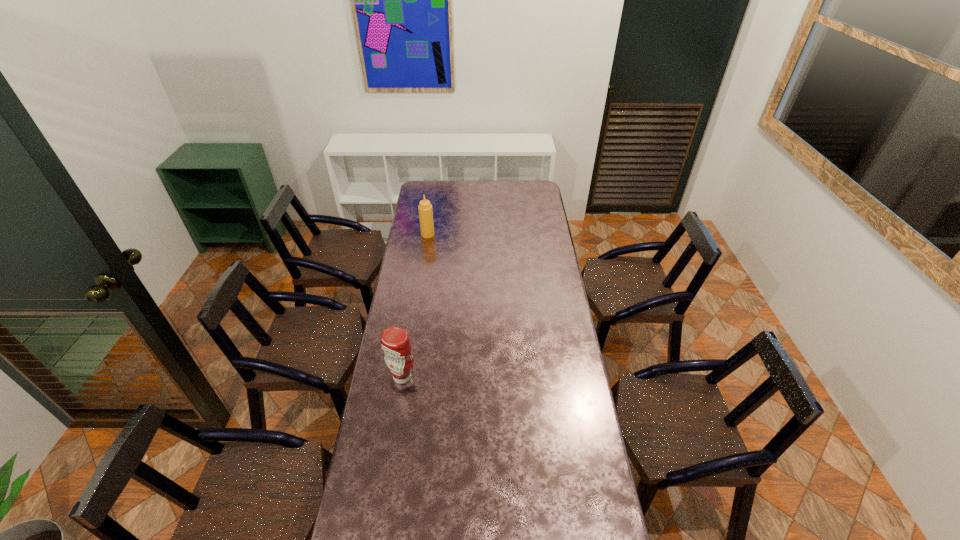
The height and width of the screenshot is (540, 960). Find the location of `the farther condiment`. the farther condiment is located at coordinates (425, 208).

In order to click on the nearer condiment in this screenshot , I will do `click(395, 341)`.

Where is `free space located 0.400m on the front of the farther object`? free space located 0.400m on the front of the farther object is located at coordinates (420, 287).

Find the location of a particular element. The width and height of the screenshot is (960, 540). free spot located 0.060m on the back of the nearer condiment is located at coordinates (406, 355).

Find the location of a particular element. vacant space at the far edge of the desktop is located at coordinates (515, 198).

You are a GUI agent. You are given a task and a screenshot of the screen. Output one action in this format:
    pyautogui.click(x=<x>, y=<y>)
    Task: Click on the vacant region at the left edge of the desktop
    This screenshot has height=540, width=960.
    Given the screenshot: What is the action you would take?
    pyautogui.click(x=397, y=278)

In the image, there is a desktop. Identify the location of vacant space at the right edge. The image size is (960, 540). (551, 354).

This screenshot has width=960, height=540. In order to click on vacant space at the far left corner in this screenshot , I will do `click(442, 185)`.

At what (x,y) coordinates should I click in order to perform the action: click on blank space at the far right corner. Please return your answer as a coordinate pair (x, y). This screenshot has width=960, height=540. Looking at the image, I should click on (529, 188).